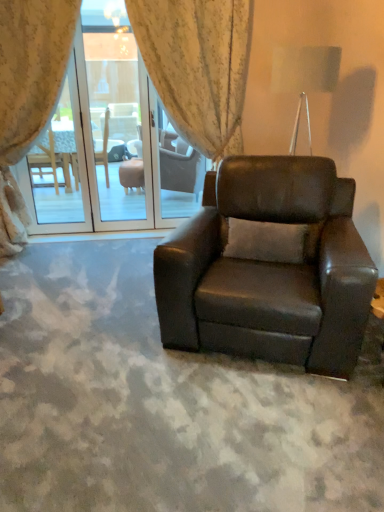
Question: Based on their sizes in the image, would you say transparent glass screen door at center is bigger or smaller than matte black armchair at center?

Choices:
 (A) big
 (B) small

Answer: (B)

Question: From their relative heights in the image, would you say transparent glass screen door at center is taller or shorter than matte black armchair at center?

Choices:
 (A) short
 (B) tall

Answer: (B)

Question: Estimate the real-world distances between objects in this image. Which object is farther from the matte black armchair at center?

Choices:
 (A) floral fabric curtain at upper left, which appears as the second curtain when viewed from the right
 (B) transparent glass screen door at center
 (C) floral fabric curtain at center, which is the first curtain in right-to-left order

Answer: (B)

Question: Which is nearer to the transparent glass screen door at center?

Choices:
 (A) floral fabric curtain at center, the second curtain viewed from the left
 (B) floral fabric curtain at upper left, which appears as the second curtain when viewed from the right
 (C) matte black armchair at center

Answer: (B)